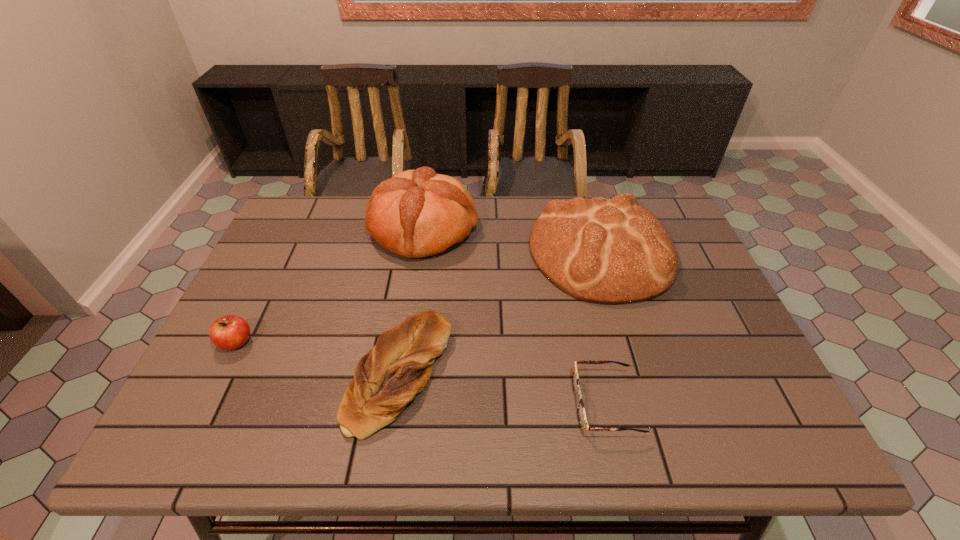
At what (x,y) coordinates should I click in order to perform the action: click on the rightmost bread. Please return your answer as a coordinate pair (x, y). This screenshot has width=960, height=540. Looking at the image, I should click on (612, 251).

Locate an element on the screen. the leftmost object is located at coordinates (229, 332).

What are the coordinates of `the second shortest object` in the screenshot? It's located at (399, 366).

Where is `the shortest bread`? The height and width of the screenshot is (540, 960). the shortest bread is located at coordinates (399, 366).

Where is `spectacles`? The image size is (960, 540). spectacles is located at coordinates (581, 413).

You are a GUI agent. You are given a task and a screenshot of the screen. Output one action in this format:
    pyautogui.click(x=<x>, y=<y>)
    Task: Click on the blank area located on the right of the rightmost bread
    Image resolution: width=960 pixels, height=540 pixels.
    Given the screenshot: What is the action you would take?
    pyautogui.click(x=697, y=253)

Find the location of `vacant space located on the back of the leftmost object`. vacant space located on the back of the leftmost object is located at coordinates (278, 256).

Locate an element on the screen. vacant space located on the left of the shortest bread is located at coordinates (283, 374).

The height and width of the screenshot is (540, 960). I want to click on vacant space situated on the frame of the shortest object, so click(443, 404).

Where is `free point located 0.170m on the frame of the shortest object`? free point located 0.170m on the frame of the shortest object is located at coordinates (494, 404).